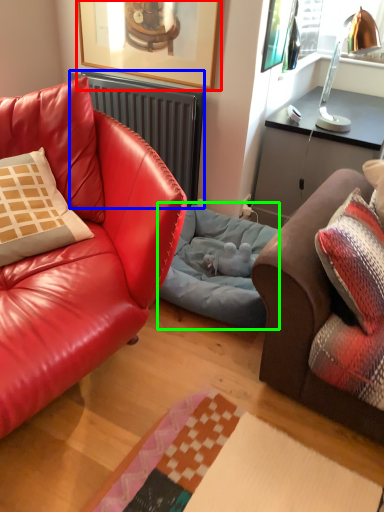
Question: Which object is the closest to the picture frame (highlighted by a red box)? Choose among these: radiator (highlighted by a blue box) or dog bed (highlighted by a green box).

Choices:
 (A) radiator
 (B) dog bed

Answer: (A)